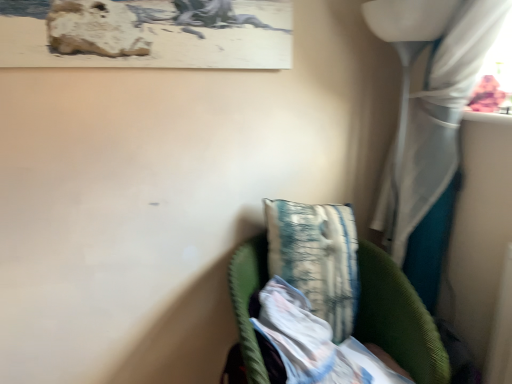
Question: From a real-world perspective, is textured fabric pillow at center on green corduroy chair at lower right?

Choices:
 (A) yes
 (B) no

Answer: (A)

Question: Considering the relative sizes of textured fabric pillow at center and green corduroy chair at lower right in the image provided, is textured fabric pillow at center taller than green corduroy chair at lower right?

Choices:
 (A) yes
 (B) no

Answer: (B)

Question: Does textured fabric pillow at center appear on the left side of green corduroy chair at lower right?

Choices:
 (A) no
 (B) yes

Answer: (B)

Question: Is the surface of textured fabric pillow at center in direct contact with green corduroy chair at lower right?

Choices:
 (A) no
 (B) yes

Answer: (B)

Question: Is textured fabric pillow at center completely or partially outside of green corduroy chair at lower right?

Choices:
 (A) yes
 (B) no

Answer: (B)

Question: Is white textured fabric at lower center wider or thinner than white sheer curtain at right?

Choices:
 (A) wide
 (B) thin

Answer: (A)

Question: Considering the positions of white textured fabric at lower center and white sheer curtain at right in the image, is white textured fabric at lower center bigger or smaller than white sheer curtain at right?

Choices:
 (A) small
 (B) big

Answer: (A)

Question: Would you say white textured fabric at lower center is inside or outside white sheer curtain at right?

Choices:
 (A) outside
 (B) inside

Answer: (A)

Question: Based on their positions, is white textured fabric at lower center located to the left or right of white sheer curtain at right?

Choices:
 (A) right
 (B) left

Answer: (B)

Question: From their relative heights in the image, would you say white sheer curtain at right is taller or shorter than white textured fabric at lower center?

Choices:
 (A) tall
 (B) short

Answer: (A)

Question: In terms of width, does white sheer curtain at right look wider or thinner when compared to white textured fabric at lower center?

Choices:
 (A) thin
 (B) wide

Answer: (A)

Question: Based on their sizes in the image, would you say white sheer curtain at right is bigger or smaller than white textured fabric at lower center?

Choices:
 (A) small
 (B) big

Answer: (B)

Question: Considering the relative positions of white sheer curtain at right and white textured fabric at lower center in the image provided, is white sheer curtain at right to the left or to the right of white textured fabric at lower center?

Choices:
 (A) left
 (B) right

Answer: (B)

Question: From the image's perspective, relative to green corduroy chair at lower right, is white textured fabric at lower center above or below?

Choices:
 (A) above
 (B) below

Answer: (A)

Question: Looking at their shapes, would you say white textured fabric at lower center is wider or thinner than green corduroy chair at lower right?

Choices:
 (A) wide
 (B) thin

Answer: (B)